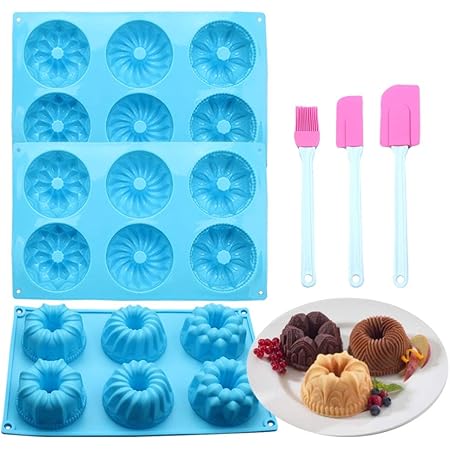
At what (x,y) coordinates should I click in order to perform the action: click on white plate. Please return your answer as a coordinate pair (x, y). The image size is (450, 450). Looking at the image, I should click on (408, 392).